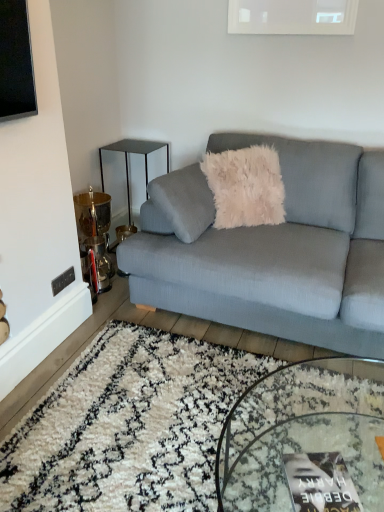
Question: From a real-world perspective, is textured gray couch at center above or below matte black magazine at lower center?

Choices:
 (A) below
 (B) above

Answer: (B)

Question: Is point (337, 289) closer or farther from the camera than point (332, 504)?

Choices:
 (A) farther
 (B) closer

Answer: (A)

Question: Based on their relative distances, which object is nearer to the textured gray couch at center?

Choices:
 (A) matte black magazine at lower center
 (B) clear glass coffee table at center
 (C) metallic black side table at upper left

Answer: (B)

Question: Estimate the real-world distances between objects in this image. Which object is closer to the textured gray couch at center?

Choices:
 (A) metallic black side table at upper left
 (B) matte black magazine at lower center
 (C) clear glass coffee table at center

Answer: (C)